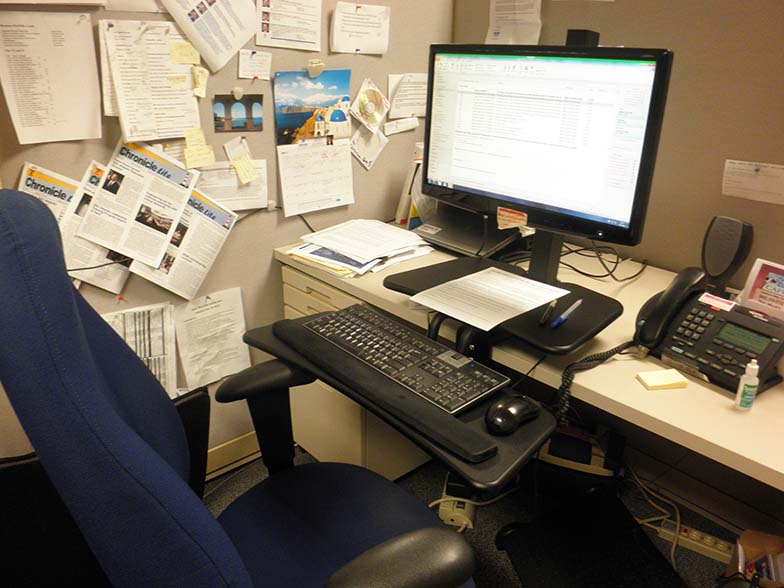
The image size is (784, 588). I want to click on calender, so click(x=299, y=116).